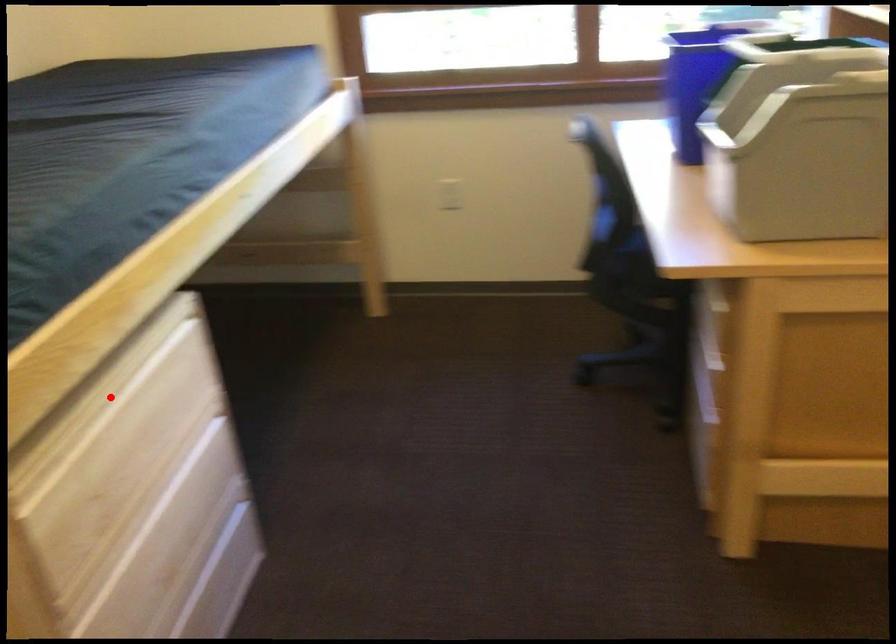
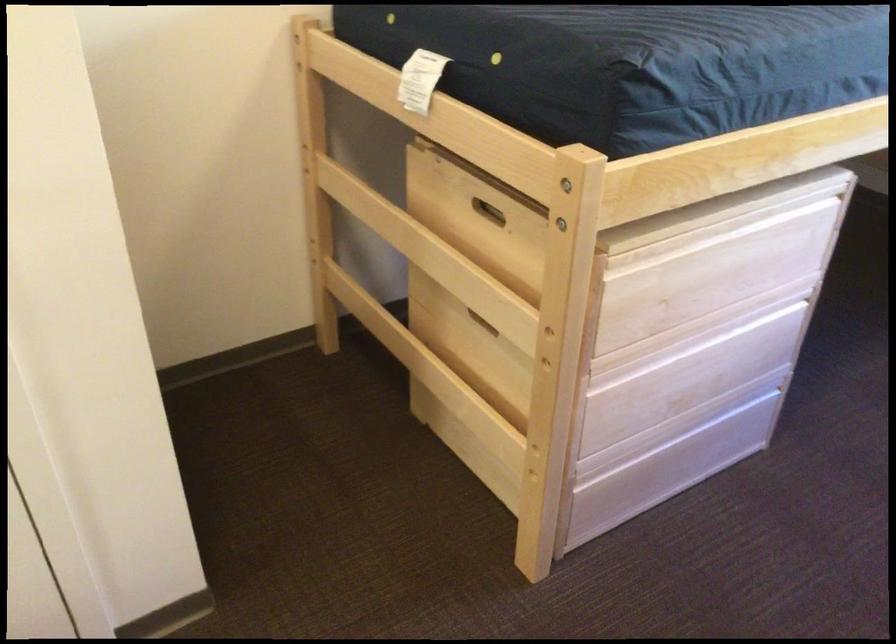
The point at the highlighted location is marked in the first image. Where is the corresponding point in the second image?

(720, 230)